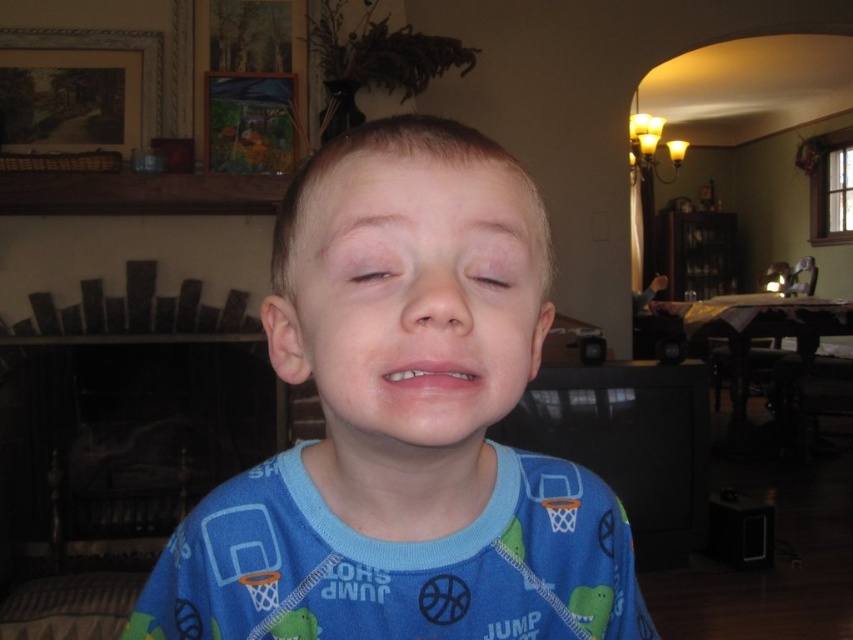
Between blue cotton pajamas at center and light brown skin at center, which one appears on the right side from the viewer's perspective?

Positioned to the right is blue cotton pajamas at center.

Which is more to the left, blue cotton pajamas at center or light brown skin at center?

Positioned to the left is light brown skin at center.

In order to click on blue cotton pajamas at center in this screenshot , I will do `click(401, 432)`.

Is blue cotton shirt at center positioned at the back of blue fabric face at center?

Yes, it is behind blue fabric face at center.

Who is shorter, blue cotton shirt at center or blue fabric face at center?

blue fabric face at center is shorter.

Which is in front, point (584, 560) or point (405, 406)?

Point (405, 406)

Locate an element on the screen. blue cotton shirt at center is located at coordinates (398, 564).

Does blue cotton pajamas at center appear over pink matte lips at center?

Incorrect, blue cotton pajamas at center is not positioned above pink matte lips at center.

Is blue cotton pajamas at center wider than pink matte lips at center?

Yes, blue cotton pajamas at center is wider than pink matte lips at center.

Describe the element at coordinates (401, 432) in the screenshot. I see `blue cotton pajamas at center` at that location.

Locate an element on the screen. blue cotton pajamas at center is located at coordinates (401, 432).